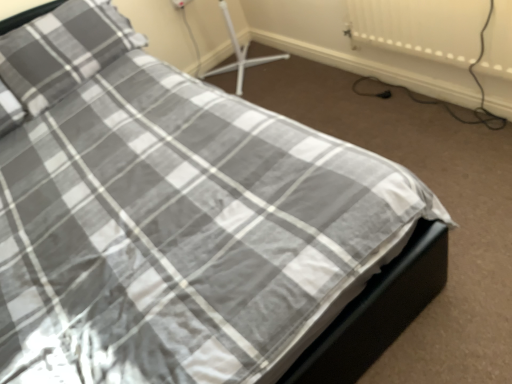
You are a GUI agent. You are given a task and a screenshot of the screen. Output one action in this format:
    pyautogui.click(x=<x>, y=<y>)
    Task: Click on the plaid fabric pillow at upper left
    The height and width of the screenshot is (384, 512).
    Given the screenshot: What is the action you would take?
    pyautogui.click(x=63, y=51)

Describe the element at coordinates (63, 51) in the screenshot. I see `plaid fabric pillow at upper left` at that location.

The width and height of the screenshot is (512, 384). Find the location of `white textured radiator at upper right`. white textured radiator at upper right is located at coordinates (421, 27).

Measure the distance between point (349,12) and camera.

A distance of 6.96 feet exists between point (349,12) and camera.

Describe the element at coordinates (421, 27) in the screenshot. The height and width of the screenshot is (384, 512). I see `white textured radiator at upper right` at that location.

In order to face white textured radiator at upper right, should I rotate leftwards or rightwards?

You should look right and rotate roughly 20.319 degrees.

This screenshot has height=384, width=512. What are the coordinates of `plaid fabric pillow at upper left` in the screenshot? It's located at (63, 51).

Based on the photo, considering the positions of objects white textured radiator at upper right and plaid fabric pillow at upper left in the image provided, who is more to the left, white textured radiator at upper right or plaid fabric pillow at upper left?

plaid fabric pillow at upper left is more to the left.

Is the position of white textured radiator at upper right less distant than that of plaid fabric pillow at upper left?

Yes.

Is point (370, 18) farther from viewer compared to point (120, 53)?

No, (370, 18) is closer to viewer.

From the image's perspective, which one is positioned lower, white textured radiator at upper right or plaid fabric pillow at upper left?

white textured radiator at upper right.

From a real-world perspective, is white textured radiator at upper right over plaid fabric pillow at upper left?

No, from a real-world perspective, white textured radiator at upper right is not above plaid fabric pillow at upper left.

Considering the relative sizes of white textured radiator at upper right and plaid fabric pillow at upper left in the image provided, is white textured radiator at upper right thinner than plaid fabric pillow at upper left?

Correct, the width of white textured radiator at upper right is less than that of plaid fabric pillow at upper left.

Between white textured radiator at upper right and plaid fabric pillow at upper left, which one has more height?

With more height is plaid fabric pillow at upper left.

Does white textured radiator at upper right have a larger size compared to plaid fabric pillow at upper left?

No.

Is white textured radiator at upper right inside or outside of plaid fabric pillow at upper left?

white textured radiator at upper right lies outside plaid fabric pillow at upper left.

Would you consider white textured radiator at upper right to be distant from plaid fabric pillow at upper left?

Yes, white textured radiator at upper right and plaid fabric pillow at upper left are located far from each other.

In the scene shown: Is white textured radiator at upper right positioned with its back to plaid fabric pillow at upper left?

No.

What's the angular difference between white textured radiator at upper right and plaid fabric pillow at upper left's facing directions?

The facing directions of white textured radiator at upper right and plaid fabric pillow at upper left are 88.5 degrees apart.

The image size is (512, 384). In order to click on radiator directly beneath the plaid fabric pillow at upper left (from a real-world perspective) in this screenshot , I will do `click(421, 27)`.

Which is more to the right, plaid fabric pillow at upper left or white textured radiator at upper right?

white textured radiator at upper right is more to the right.

Is plaid fabric pillow at upper left positioned before white textured radiator at upper right?

No.

Does point (78, 9) come farther from viewer compared to point (436, 0)?

Yes, it is.

From the image's perspective, is plaid fabric pillow at upper left above white textured radiator at upper right?

Indeed, from the image's perspective, plaid fabric pillow at upper left is shown above white textured radiator at upper right.

From a real-world perspective, is plaid fabric pillow at upper left over white textured radiator at upper right?

Yes, from a real-world perspective, plaid fabric pillow at upper left is over white textured radiator at upper right

Is plaid fabric pillow at upper left thinner than white textured radiator at upper right?

No, plaid fabric pillow at upper left is not thinner than white textured radiator at upper right.

Which of these two, plaid fabric pillow at upper left or white textured radiator at upper right, stands shorter?

Standing shorter between the two is white textured radiator at upper right.

Considering the sizes of objects plaid fabric pillow at upper left and white textured radiator at upper right in the image provided, who is bigger, plaid fabric pillow at upper left or white textured radiator at upper right?

plaid fabric pillow at upper left is bigger.

Would you say plaid fabric pillow at upper left is inside or outside white textured radiator at upper right?

The correct answer is: outside.

Are plaid fabric pillow at upper left and white textured radiator at upper right far apart?

That's right, there is a large distance between plaid fabric pillow at upper left and white textured radiator at upper right.

Is plaid fabric pillow at upper left oriented away from white textured radiator at upper right?

plaid fabric pillow at upper left is not turned away from white textured radiator at upper right.

How different are the orientations of plaid fabric pillow at upper left and white textured radiator at upper right in degrees?

88.5 degrees separate the facing orientations of plaid fabric pillow at upper left and white textured radiator at upper right.

How much distance is there between plaid fabric pillow at upper left and white textured radiator at upper right?

plaid fabric pillow at upper left is 1.36 meters from white textured radiator at upper right.

Find the location of a particular element. This screenshot has height=384, width=512. radiator in front of the plaid fabric pillow at upper left is located at coordinates (421, 27).

I want to click on radiator lying on the right of plaid fabric pillow at upper left, so click(421, 27).

In the image, there is a white textured radiator at upper right. In order to click on pillow above it (from the image's perspective) in this screenshot , I will do `click(63, 51)`.